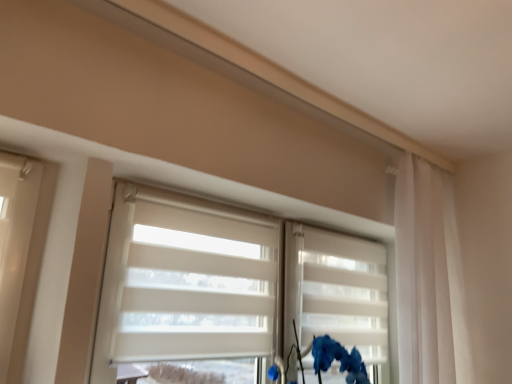
Question: Is matte blue flower at lower right completely or partially inside white sheer curtain at right?

Choices:
 (A) yes
 (B) no

Answer: (B)

Question: Does white sheer curtain at right have a smaller size compared to matte blue flower at lower right?

Choices:
 (A) no
 (B) yes

Answer: (A)

Question: Does white sheer curtain at right have a lesser width compared to matte blue flower at lower right?

Choices:
 (A) no
 (B) yes

Answer: (B)

Question: Does white sheer curtain at right appear on the right side of matte blue flower at lower right?

Choices:
 (A) no
 (B) yes

Answer: (B)

Question: Is white sheer curtain at right looking in the opposite direction of matte blue flower at lower right?

Choices:
 (A) yes
 (B) no

Answer: (B)

Question: Considering the positions of white sheer curtain at right and white matte shutter at center in the image, is white sheer curtain at right wider or thinner than white matte shutter at center?

Choices:
 (A) thin
 (B) wide

Answer: (B)

Question: Looking at the image, does white sheer curtain at right seem bigger or smaller compared to white matte shutter at center?

Choices:
 (A) big
 (B) small

Answer: (A)

Question: In the image, is white sheer curtain at right on the left side or the right side of white matte shutter at center?

Choices:
 (A) left
 (B) right

Answer: (B)

Question: From a real-world perspective, is white sheer curtain at right physically located above or below white matte shutter at center?

Choices:
 (A) above
 (B) below

Answer: (A)

Question: Considering the positions of white sheer curtain at right and matte blue flower at lower right in the image, is white sheer curtain at right bigger or smaller than matte blue flower at lower right?

Choices:
 (A) big
 (B) small

Answer: (A)

Question: Is white sheer curtain at right taller or shorter than matte blue flower at lower right?

Choices:
 (A) tall
 (B) short

Answer: (A)

Question: Would you say white sheer curtain at right is inside or outside matte blue flower at lower right?

Choices:
 (A) outside
 (B) inside

Answer: (A)

Question: Considering their positions, is white sheer curtain at right located in front of or behind matte blue flower at lower right?

Choices:
 (A) front
 (B) behind

Answer: (B)

Question: Would you say matte blue flower at lower right is inside or outside white matte blinds at center?

Choices:
 (A) inside
 (B) outside

Answer: (B)

Question: Based on their positions, is matte blue flower at lower right located to the left or right of white matte blinds at center?

Choices:
 (A) left
 (B) right

Answer: (B)